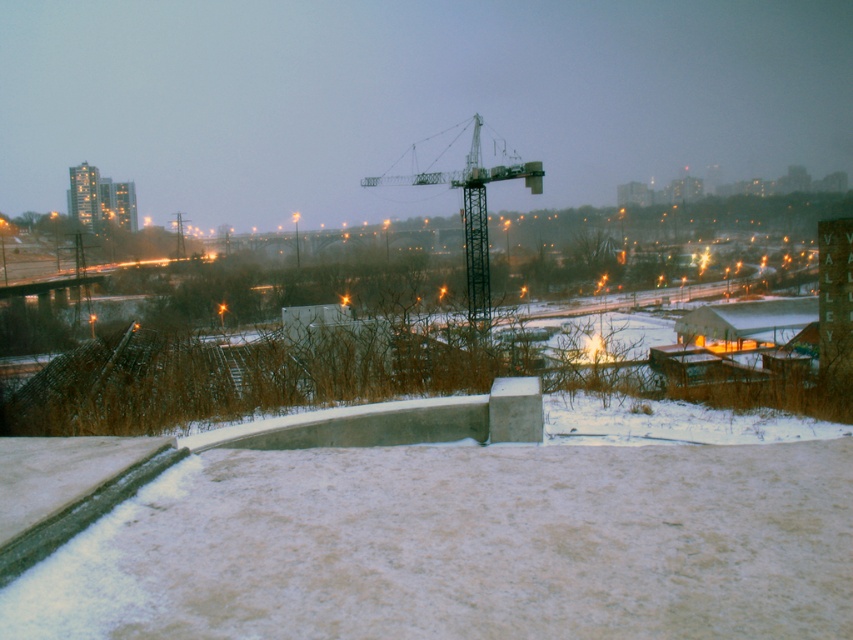
Question: Is white powdery snow at lower center positioned behind metallic gray crane at center?

Choices:
 (A) no
 (B) yes

Answer: (A)

Question: Does white powdery snow at lower center lie in front of metallic gray crane at center?

Choices:
 (A) yes
 (B) no

Answer: (A)

Question: Can you confirm if white powdery snow at lower center is positioned below metallic gray crane at center?

Choices:
 (A) yes
 (B) no

Answer: (A)

Question: Which point appears farthest from the camera in this image?

Choices:
 (A) (485, 291)
 (B) (473, 577)

Answer: (A)